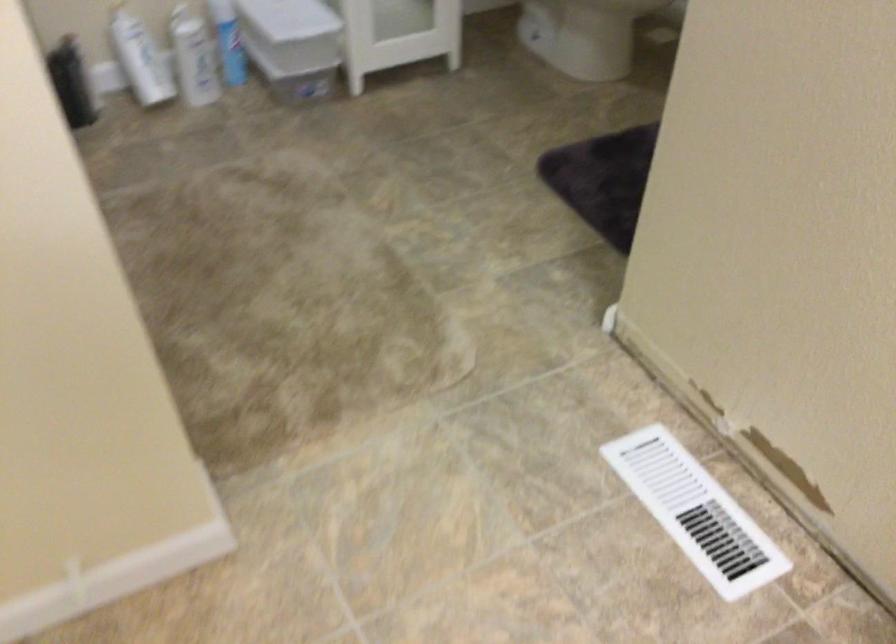
What do you see at coordinates (293, 32) in the screenshot? Image resolution: width=896 pixels, height=644 pixels. I see `the white bin lid` at bounding box center [293, 32].